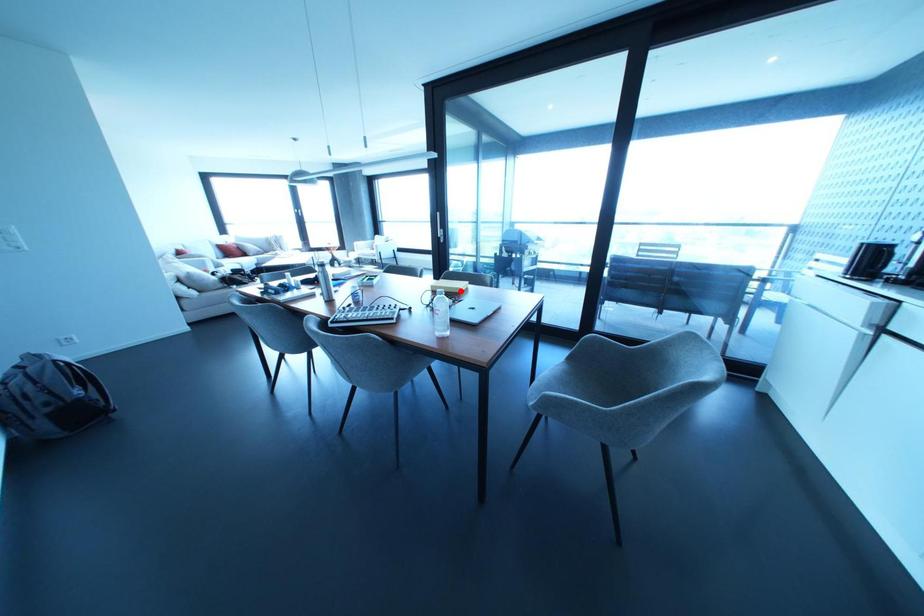
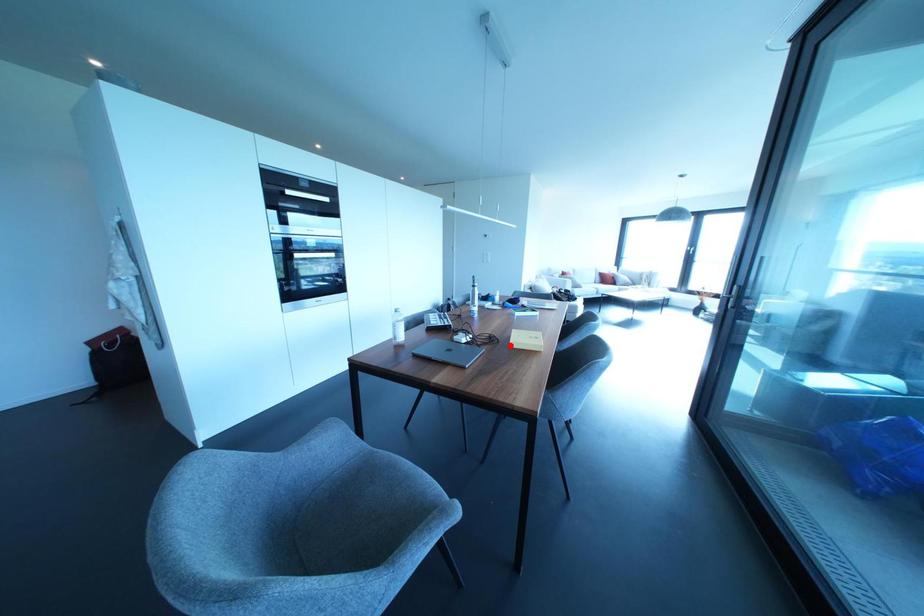
I am providing you with two images of the same scene from different viewpoints. A red point is marked on the first image and another point is marked on the second image. Is the red point in image1 aligned with the point shown in image2?

Yes